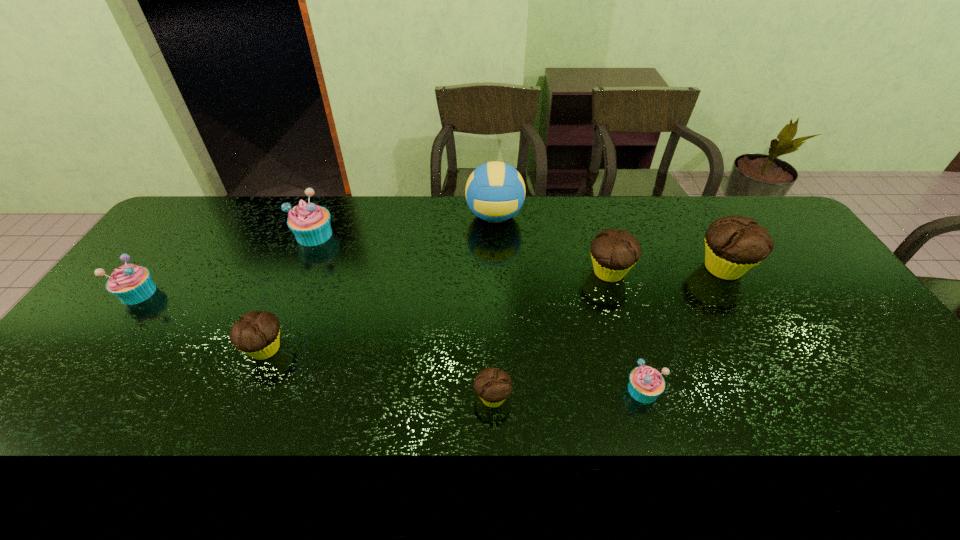
The image size is (960, 540). In order to click on the third biggest chocolate muffin in this screenshot , I will do `click(257, 333)`.

Image resolution: width=960 pixels, height=540 pixels. In order to click on the rightmost blue muffin in this screenshot , I will do `click(646, 383)`.

I want to click on the nearest blue muffin, so click(x=646, y=383).

This screenshot has width=960, height=540. I want to click on the second chocolate muffin from left to right, so click(493, 386).

Where is `the smallest chocolate muffin`? This screenshot has width=960, height=540. the smallest chocolate muffin is located at coordinates (493, 386).

Image resolution: width=960 pixels, height=540 pixels. What are the coordinates of `vacant region located on the left of the tallest object` in the screenshot? It's located at (441, 217).

Locate an element on the screen. The width and height of the screenshot is (960, 540). vacant space located 0.320m on the left of the rightmost chocolate muffin is located at coordinates (592, 268).

Where is `vacant space located on the right of the second blue muffin from right to left`? The image size is (960, 540). vacant space located on the right of the second blue muffin from right to left is located at coordinates (352, 235).

Identify the location of vacant space located 0.070m on the left of the third smallest chocolate muffin. This screenshot has height=540, width=960. (563, 273).

Find the location of `free space located on the right of the leftmost muffin`. free space located on the right of the leftmost muffin is located at coordinates (241, 293).